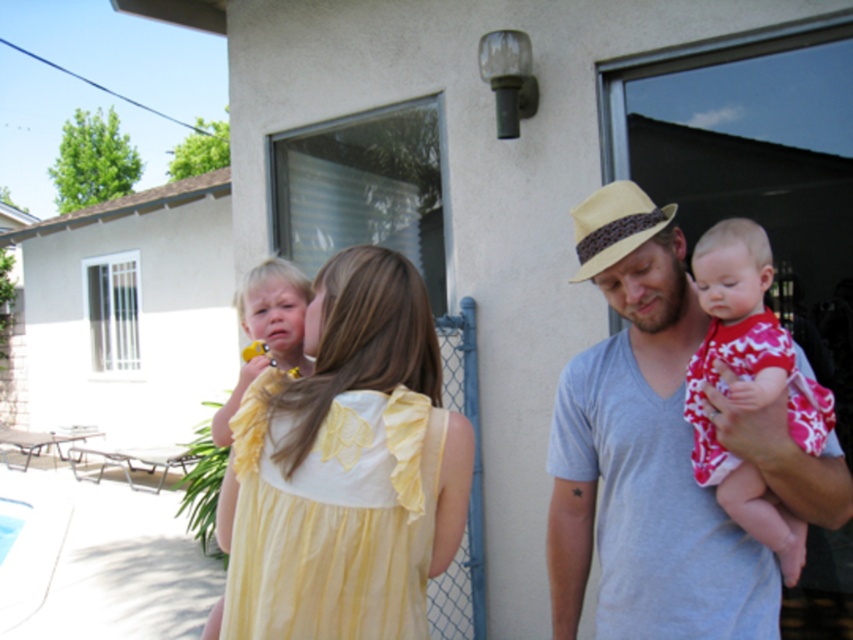
Where is the yellow chiffon dress at center located in the image?

The yellow chiffon dress at center is located at point (334,518) in the image.

You are a photographer trying to capture a photo of the two children wearing yellow dresses. The scene has the yellow chiffon dress at center and the yellow cotton dress at center. Which dress is positioned lower in the image?

The yellow chiffon dress at center is located below the yellow cotton dress at center, so it is positioned lower in the image.

You are standing in front of the residential building and want to take a photo of the point at coordinates (335, 616). If your camera has a focal length of 50mm and you are 1.44 meters away from the point, what is the angle of view required to capture the entire scene around the point in the photo?

The point at coordinates (335, 616) is 1.44 meters away from the viewer. To calculate the angle of view needed, use the formula for angle of view calculation based on focal length and distance. However, without knowing the sensor size or the desired field of view dimensions, an exact angle cannot be determined. Ensure your camera settings accommodate the distance and focal length to capture the scene appropriately.